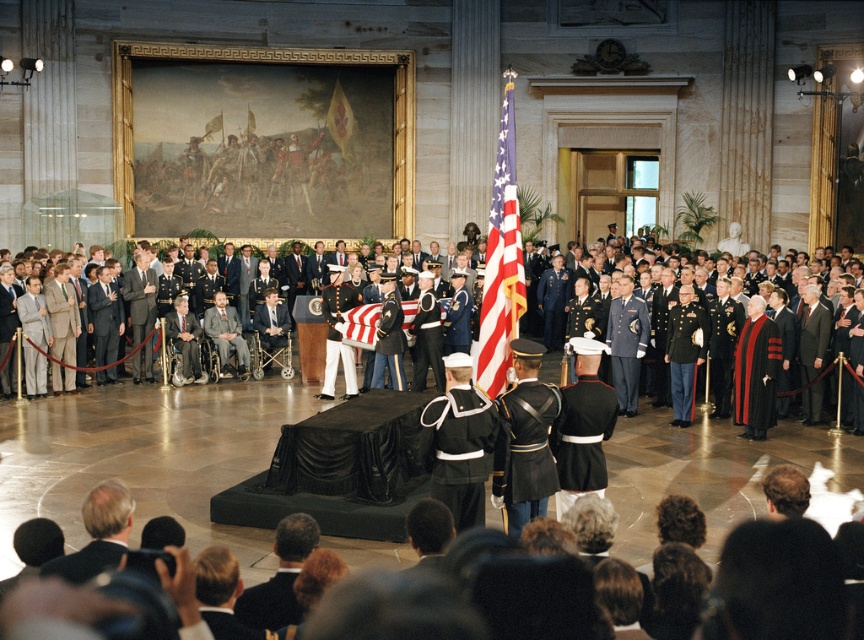
You are attending the ceremony and need to locate two attendees wearing dark suits. The first is wearing a dark brown suit at lower center, and the second is in a dark suit at lower left. From your perspective facing the casket, which attendee is positioned to the east?

The dark brown suit at lower center is to the right of dark suit at lower left. Since right corresponds to east in this scene, the dark brown suit at lower center is positioned to the east.

Based on the photo, you are attending a military ceremony and notice two items of importance. One is the black glossy uniform at center and the other is the red flag at upper center. Which of these two items is bigger in size?

The black glossy uniform at center is larger in size than the red flag at upper center.

You are a photographer positioned to capture the ceremony. You need to ensure both the black glossy uniform at center and the dark suit at lower left are visible in the frame. Considering their sizes, which one might require more space in the composition?

The black glossy uniform at center requires more space in the composition because its width surpasses that of the dark suit at lower left.